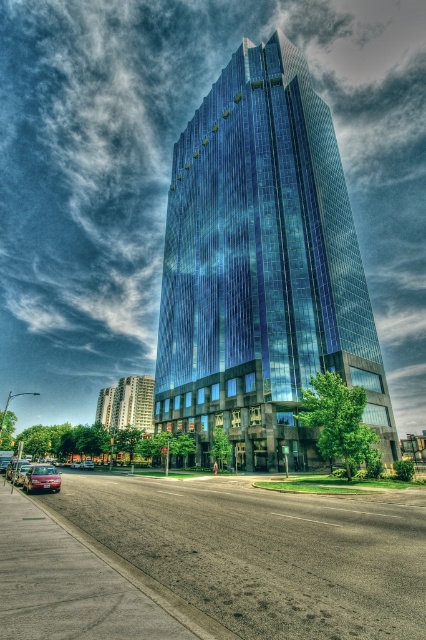
Question: Is shiny red sedan at lower left smaller than metallic silver sedan at center?

Choices:
 (A) yes
 (B) no

Answer: (B)

Question: Can you confirm if shiny glass skyscraper at center is bigger than metallic silver sedan at center?

Choices:
 (A) yes
 (B) no

Answer: (A)

Question: Is shiny glass skyscraper at center below metallic silver sedan at center?

Choices:
 (A) no
 (B) yes

Answer: (A)

Question: Based on their relative distances, which object is nearer to the metallic silver sedan at center?

Choices:
 (A) shiny glass skyscraper at center
 (B) shiny red sedan at lower left

Answer: (B)

Question: Based on their relative distances, which object is farther from the shiny red sedan at lower left?

Choices:
 (A) shiny glass skyscraper at center
 (B) metallic silver sedan at center

Answer: (A)

Question: Among these objects, which one is farthest from the camera?

Choices:
 (A) shiny red sedan at lower left
 (B) metallic silver sedan at center

Answer: (B)